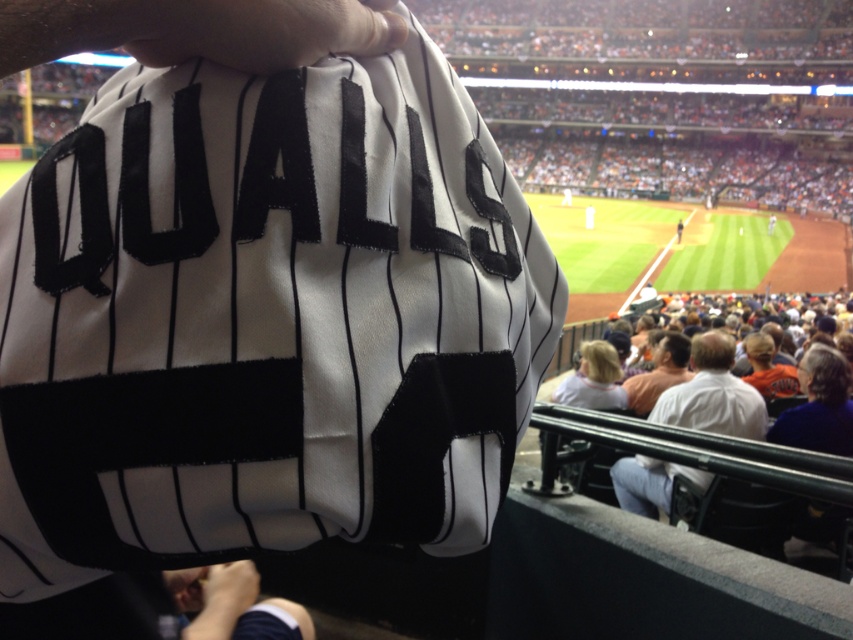
Looking at this image, is white fabric shirt at lower right below orange jersey at center?

Incorrect, white fabric shirt at lower right is not positioned below orange jersey at center.

Between white fabric shirt at lower right and orange jersey at center, which one is positioned higher?

white fabric shirt at lower right is higher up.

The width and height of the screenshot is (853, 640). Find the location of `white fabric shirt at lower right`. white fabric shirt at lower right is located at coordinates (712, 394).

Locate an element on the screen. This screenshot has width=853, height=640. white fabric shirt at lower right is located at coordinates point(712,394).

Does white matte baseball uniform at center have a greater width compared to orange jersey at center?

No, white matte baseball uniform at center is not wider than orange jersey at center.

Can you confirm if white matte baseball uniform at center is positioned to the left of orange jersey at center?

Yes, white matte baseball uniform at center is to the left of orange jersey at center.

Which is behind, point (64, 147) or point (685, 362)?

The point (685, 362) is behind.

Where is `white matte baseball uniform at center`? Image resolution: width=853 pixels, height=640 pixels. white matte baseball uniform at center is located at coordinates (264, 321).

Is point (88, 264) positioned in front of point (186, 628)?

Yes, point (88, 264) is in front of point (186, 628).

At what (x,y) coordinates should I click in order to perform the action: click on white matte baseball uniform at center. Please return your answer as a coordinate pair (x, y). This screenshot has height=640, width=853. Looking at the image, I should click on (264, 321).